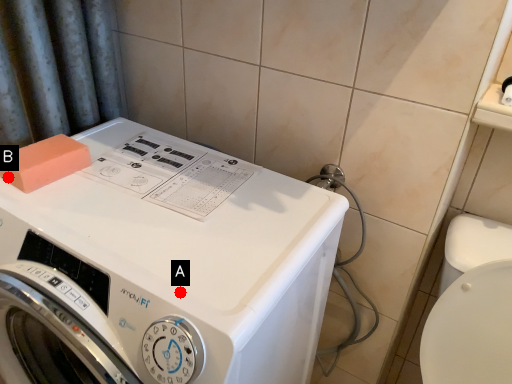
Question: Two points are circled on the image, labeled by A and B beside each circle. Which point is farther to the camera?

Choices:
 (A) A is further
 (B) B is further

Answer: (B)